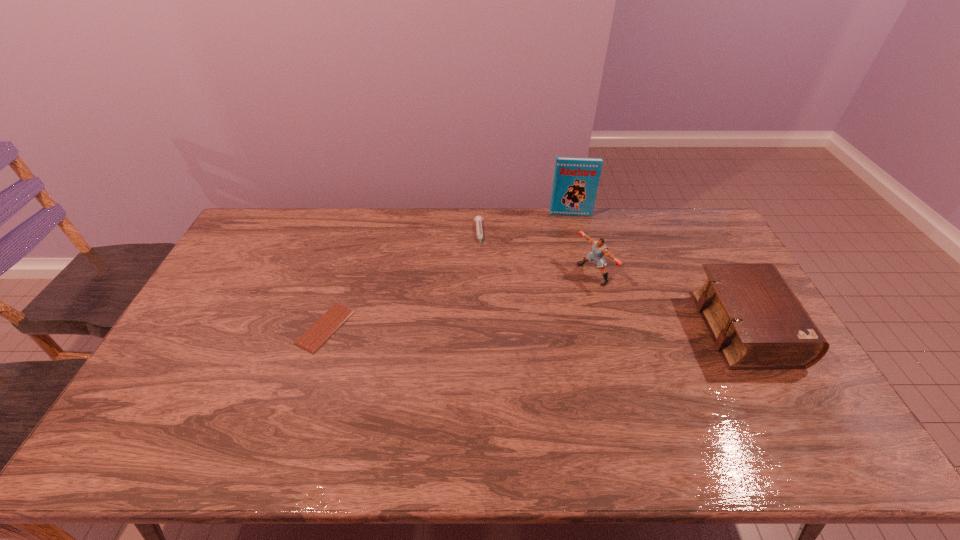
This screenshot has height=540, width=960. Identify the location of book located at the far edge. (576, 179).

This screenshot has height=540, width=960. I want to click on object that is positioned at the right edge, so click(x=756, y=321).

This screenshot has height=540, width=960. I want to click on free space at the far edge of the desktop, so click(348, 220).

The width and height of the screenshot is (960, 540). Identify the location of free space at the near edge. (390, 405).

You are a GUI agent. You are given a task and a screenshot of the screen. Output one action in this format:
    pyautogui.click(x=<x>, y=<y>)
    Task: Click on the vacant region at the left edge of the desktop
    
    Given the screenshot: What is the action you would take?
    pyautogui.click(x=217, y=371)

In the image, there is a desktop. Identify the location of vacant area at the near left corner. (154, 404).

What are the coordinates of `vacant space that's between the syringe and the farthest object` in the screenshot? It's located at (524, 225).

Find the location of a particular element. vacant space that's between the rightmost object and the farthest object is located at coordinates (658, 271).

The image size is (960, 540). I want to click on free point between the fourth object from right to left and the shortest object, so click(402, 281).

At what (x,y) coordinates should I click in order to perform the action: click on empty space that is in between the shortest object and the third tallest object. Please return your answer as a coordinate pair (x, y). This screenshot has height=540, width=960. Looking at the image, I should click on click(536, 328).